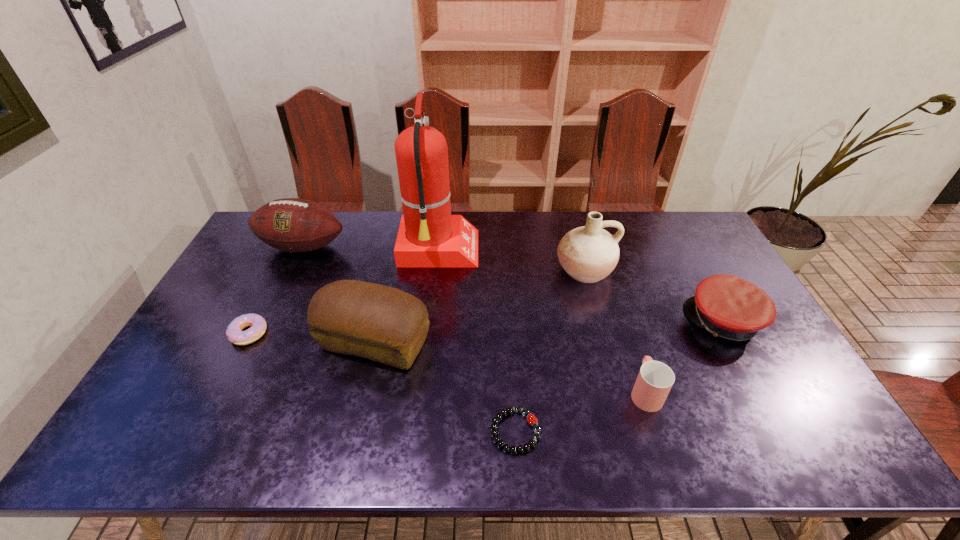
Find the location of a particular element. The width and height of the screenshot is (960, 540). the tallest object is located at coordinates (429, 236).

Where is `pottery`? The height and width of the screenshot is (540, 960). pottery is located at coordinates click(588, 254).

Locate an element on the screen. The image size is (960, 540). football (American) is located at coordinates (293, 225).

At what (x,y) coordinates should I click in order to perform the action: click on bread. Please return your answer as a coordinate pair (x, y). Looking at the image, I should click on (384, 324).

Image resolution: width=960 pixels, height=540 pixels. I want to click on the rightmost object, so click(727, 306).

Find the location of a particular element. cup is located at coordinates (655, 379).

At what (x,y) coordinates should I click in order to perform the action: click on the seventh tallest object. Please return your answer as a coordinate pair (x, y). This screenshot has width=960, height=540. Looking at the image, I should click on (257, 324).

Image resolution: width=960 pixels, height=540 pixels. Identify the location of the fifth object from left to right. (532, 420).

Locate an element on the screen. Image resolution: width=960 pixels, height=540 pixels. bracelet is located at coordinates (532, 420).

This screenshot has width=960, height=540. I want to click on vacant space located 0.390m on the front-facing side of the fire extinguisher, so click(x=590, y=251).